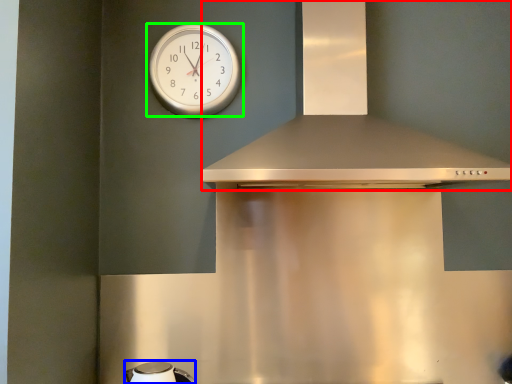
Question: Estimate the real-world distances between objects in this image. Which object is farther from vent (highlighted by a red box), appliance (highlighted by a blue box) or wall clock (highlighted by a green box)?

Choices:
 (A) appliance
 (B) wall clock

Answer: (A)